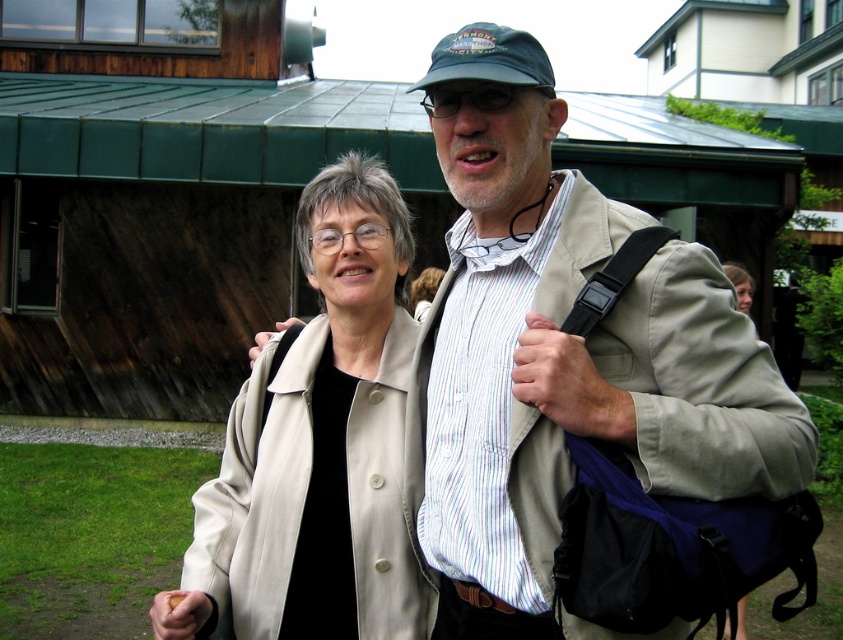
Looking at this image, you are a photographer who needs to take a photo of the beige fabric coat at center and the camera. The minimum distance required for your camera to focus properly is 6 feet. Can you take the photo without moving either object?

The beige fabric coat at center and camera are 6.67 feet apart from each other, so yes, the camera can focus properly as the distance is more than the required 6 feet.

You are a fashion designer observing two people in an outdoor setting. You need to determine the spatial relationship between the beige fabric coat at center and the dark blue fabric baseball cap at upper center. Which object is positioned higher in the image?

The dark blue fabric baseball cap at upper center is positioned higher in the image than the beige fabric coat at center.

You are standing at the point with coordinates point (470, 56) and want to move to the point with coordinates point (201, 582). Is the destination point behind you or in front of you?

The destination point (201, 582) is behind point (470, 56), so it is behind you.